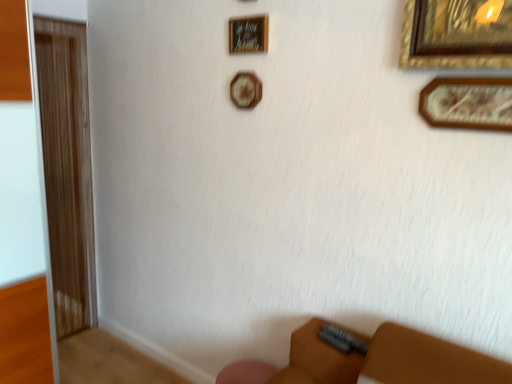
Question: Does wooden picture frame at upper center, which is counted as the first picture frame, starting from the left, have a lesser width compared to wooden picture frame at upper right, which is the third picture frame from back to front?

Choices:
 (A) no
 (B) yes

Answer: (B)

Question: Can you confirm if wooden picture frame at upper center, which is counted as the second picture frame, starting from the bottom, is wider than wooden picture frame at upper right, which is the third picture frame from back to front?

Choices:
 (A) no
 (B) yes

Answer: (A)

Question: Would you say wooden picture frame at upper center, which ranks as the 3th picture frame in front-to-back order, is outside wooden picture frame at upper right, the 3th picture frame when ordered from left to right?

Choices:
 (A) no
 (B) yes

Answer: (B)

Question: Is wooden picture frame at upper center, which ranks as the 3th picture frame in front-to-back order, turned away from wooden picture frame at upper right, which is the third picture frame from back to front?

Choices:
 (A) no
 (B) yes

Answer: (A)

Question: From a real-world perspective, is wooden picture frame at upper center, which is the 3th picture frame from right to left, physically below wooden picture frame at upper right, the first picture frame from the bottom?

Choices:
 (A) no
 (B) yes

Answer: (A)

Question: From the image's perspective, is wooden picture frame at upper center, which is the 3th picture frame from right to left, positioned above or below wooden plaque at upper center, which is the 2th picture frame in front-to-back order?

Choices:
 (A) below
 (B) above

Answer: (A)

Question: In terms of height, does wooden picture frame at upper center, which ranks as the 3th picture frame in front-to-back order, look taller or shorter compared to wooden plaque at upper center, which is the 2th picture frame in right-to-left order?

Choices:
 (A) tall
 (B) short

Answer: (A)

Question: Relative to wooden plaque at upper center, arranged as the 3th picture frame when ordered from the bottom, is wooden picture frame at upper center, which is counted as the first picture frame, starting from the left, in front or behind?

Choices:
 (A) front
 (B) behind

Answer: (B)

Question: Which is correct: wooden picture frame at upper center, the first picture frame positioned from the back, is inside wooden plaque at upper center, which is the 2th picture frame in front-to-back order, or outside of it?

Choices:
 (A) inside
 (B) outside

Answer: (B)

Question: From the image's perspective, is wooden picture frame at upper right, the 3th picture frame when ordered from left to right, positioned above or below wooden picture frame at upper center, arranged as the 2th picture frame when viewed from the top?

Choices:
 (A) above
 (B) below

Answer: (B)

Question: Based on their positions, is wooden picture frame at upper right, acting as the 3th picture frame starting from the top, located to the left or right of wooden picture frame at upper center, which is the 3th picture frame from right to left?

Choices:
 (A) right
 (B) left

Answer: (A)

Question: From a real-world perspective, is wooden picture frame at upper right, which is the third picture frame from back to front, physically located above or below wooden picture frame at upper center, which is counted as the first picture frame, starting from the left?

Choices:
 (A) above
 (B) below

Answer: (B)

Question: Considering their positions, is wooden picture frame at upper right, the 1th picture frame when ordered from right to left, located in front of or behind wooden picture frame at upper center, which is counted as the second picture frame, starting from the bottom?

Choices:
 (A) front
 (B) behind

Answer: (A)

Question: Relative to wooden picture frame at upper center, arranged as the 2th picture frame when viewed from the top, is wooden plaque at upper center, which appears as the 1th picture frame when viewed from the top, in front or behind?

Choices:
 (A) behind
 (B) front

Answer: (B)

Question: From the image's perspective, is wooden plaque at upper center, which is the 2th picture frame in right-to-left order, located above or below wooden picture frame at upper center, which is counted as the second picture frame, starting from the bottom?

Choices:
 (A) above
 (B) below

Answer: (A)